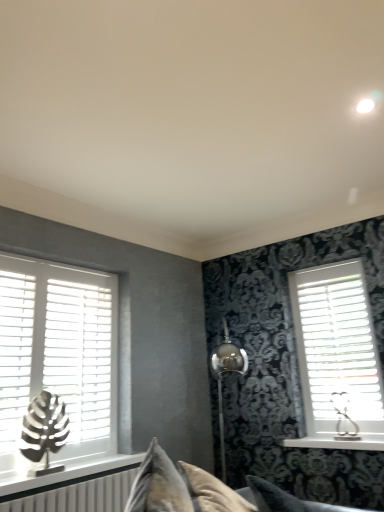
What do you see at coordinates (338, 442) in the screenshot?
I see `white wood window sill at right` at bounding box center [338, 442].

Measure the distance between point (333, 416) and camera.

Point (333, 416) and camera are 2.78 meters apart from each other.

The width and height of the screenshot is (384, 512). Describe the element at coordinates (80, 355) in the screenshot. I see `white matte blinds at left` at that location.

Measure the distance between white matte shutter at left and camera.

The distance of white matte shutter at left from camera is 6.87 feet.

You are a GUI agent. You are given a task and a screenshot of the screen. Output one action in this format:
    pyautogui.click(x=<x>, y=<y>)
    Task: Click on the velvet gray pillow at lower center
    
    Given the screenshot: What is the action you would take?
    pyautogui.click(x=286, y=499)

Who is shorter, white matte blinds at left or white wood blinds at left, which appears as the 1th window when viewed from the left?

Standing shorter between the two is white matte blinds at left.

From a real-world perspective, is white matte blinds at left under white wood blinds at left, which appears as the 2th window when viewed from the right?

Yes.

In terms of size, does white matte blinds at left appear bigger or smaller than white wood blinds at left, which appears as the 1th window when viewed from the left?

Clearly, white matte blinds at left is smaller in size than white wood blinds at left, which appears as the 1th window when viewed from the left.

Considering the relative sizes of metallic leaf sculpture at left, marked as the second table lamp in a back-to-front arrangement, and white plastic blinds at right, which is the 1th window in right-to-left order, in the image provided, is metallic leaf sculpture at left, marked as the second table lamp in a back-to-front arrangement, shorter than white plastic blinds at right, which is the 1th window in right-to-left order,?

Indeed, metallic leaf sculpture at left, marked as the second table lamp in a back-to-front arrangement, has a lesser height compared to white plastic blinds at right, which is the 1th window in right-to-left order.

Measure the distance between metallic leaf sculpture at left, marked as the second table lamp in a back-to-front arrangement, and white plastic blinds at right, which is the 1th window in right-to-left order.

5.64 feet.

Is metallic leaf sculpture at left, the 2th table lamp when ordered from right to left, facing away from white plastic blinds at right, which is the 1th window in right-to-left order?

That's not correct — metallic leaf sculpture at left, the 2th table lamp when ordered from right to left, is not looking away from white plastic blinds at right, which is the 1th window in right-to-left order.

Considering their positions, is metallic leaf sculpture at left, positioned as the first table lamp in left-to-right order, located in front of or behind white plastic blinds at right, arranged as the second window when viewed from the left?

Clearly, metallic leaf sculpture at left, positioned as the first table lamp in left-to-right order, is in front of white plastic blinds at right, arranged as the second window when viewed from the left.

Considering the relative sizes of velvet gray pillow at lower center and white wood blinds at left, which appears as the 1th window when viewed from the left, in the image provided, is velvet gray pillow at lower center bigger than white wood blinds at left, which appears as the 1th window when viewed from the left,?

Yes, velvet gray pillow at lower center is bigger than white wood blinds at left, which appears as the 1th window when viewed from the left.

Considering the relative sizes of velvet gray pillow at lower center and white wood blinds at left, which appears as the 2th window when viewed from the right, in the image provided, is velvet gray pillow at lower center shorter than white wood blinds at left, which appears as the 2th window when viewed from the right,?

Indeed, velvet gray pillow at lower center has a lesser height compared to white wood blinds at left, which appears as the 2th window when viewed from the right.

Is velvet gray pillow at lower center looking in the opposite direction of white wood blinds at left, which appears as the 1th window when viewed from the left?

velvet gray pillow at lower center is not turned away from white wood blinds at left, which appears as the 1th window when viewed from the left.

Between velvet gray pillow at lower center and white wood blinds at left, which appears as the 1th window when viewed from the left, which one has smaller width?

white wood blinds at left, which appears as the 1th window when viewed from the left, is thinner.

Relative to metallic leaf sculpture at left, marked as the second table lamp in a back-to-front arrangement, is white matte shutter at left in front or behind?

Visually, white matte shutter at left is located behind metallic leaf sculpture at left, marked as the second table lamp in a back-to-front arrangement.

Does white matte shutter at left have a lesser width compared to metallic leaf sculpture at left, marked as the second table lamp in a back-to-front arrangement?

Indeed, white matte shutter at left has a lesser width compared to metallic leaf sculpture at left, marked as the second table lamp in a back-to-front arrangement.

Is white matte shutter at left to the right of metallic leaf sculpture at left, marked as the second table lamp in a back-to-front arrangement, from the viewer's perspective?

In fact, white matte shutter at left is to the left of metallic leaf sculpture at left, marked as the second table lamp in a back-to-front arrangement.

Based on the photo, is white wood window sill at right in front of white matte blinds at left?

That is False.

Is white wood window sill at right positioned far away from white matte blinds at left?

That's right, there is a large distance between white wood window sill at right and white matte blinds at left.

In terms of width, does white wood window sill at right look wider or thinner when compared to white matte blinds at left?

Considering their sizes, white wood window sill at right looks broader than white matte blinds at left.

Does point (322, 507) appear closer or farther from the camera than point (35, 454)?

Point (322, 507) is farther from the camera than point (35, 454).

Considering the positions of objects velvet gray pillow at lower center and metallic leaf sculpture at left, positioned as the first table lamp in left-to-right order, in the image provided, who is more to the left, velvet gray pillow at lower center or metallic leaf sculpture at left, positioned as the first table lamp in left-to-right order,?

Positioned to the left is metallic leaf sculpture at left, positioned as the first table lamp in left-to-right order.

From the image's perspective, is velvet gray pillow at lower center above or below metallic leaf sculpture at left, positioned as the first table lamp in left-to-right order?

Clearly, from the image's perspective, velvet gray pillow at lower center is below metallic leaf sculpture at left, positioned as the first table lamp in left-to-right order.

What's the angular difference between metallic leaf sculpture at left, positioned as the first table lamp in left-to-right order, and white matte shutter at left's facing directions?

There is a 0.00116-degree angle between the facing directions of metallic leaf sculpture at left, positioned as the first table lamp in left-to-right order, and white matte shutter at left.

Considering the relative sizes of metallic leaf sculpture at left, positioned as the first table lamp in left-to-right order, and white matte shutter at left in the image provided, is metallic leaf sculpture at left, positioned as the first table lamp in left-to-right order, wider than white matte shutter at left?

Yes, metallic leaf sculpture at left, positioned as the first table lamp in left-to-right order, is wider than white matte shutter at left.

Does metallic leaf sculpture at left, the 1th table lamp in the front-to-back sequence, have a larger size compared to white matte shutter at left?

No.

From a real-world perspective, does metallic leaf sculpture at left, marked as the second table lamp in a back-to-front arrangement, sit lower than white matte shutter at left?

Yes, from a real-world perspective, metallic leaf sculpture at left, marked as the second table lamp in a back-to-front arrangement, is below white matte shutter at left.

This screenshot has height=512, width=384. I want to click on blind that is behind the white wood blinds at left, which appears as the 2th window when viewed from the right, so click(80, 355).

Where is `window that is the 1st one when counting upward from the metallic leaf sculpture at left, the 1th table lamp in the front-to-back sequence (from the image's perspective)`? window that is the 1st one when counting upward from the metallic leaf sculpture at left, the 1th table lamp in the front-to-back sequence (from the image's perspective) is located at coordinates (337, 352).

Estimate the real-world distances between objects in this image. Which object is further from white wood blinds at left, which appears as the 1th window when viewed from the left, metallic silver table lamp at right, which is the 1th table lamp from back to front, or white wood window sill at right?

Based on the image, metallic silver table lamp at right, which is the 1th table lamp from back to front, appears to be further to white wood blinds at left, which appears as the 1th window when viewed from the left.

Considering their positions, is metallic leaf sculpture at left, marked as the second table lamp in a back-to-front arrangement, positioned closer to white matte blinds at left than white matte shutter at left?

white matte shutter at left is closer to white matte blinds at left.

When comparing their distances from white wood blinds at left, which appears as the 1th window when viewed from the left, does metallic silver table lamp at right, the second table lamp in the front-to-back sequence, or metallic leaf sculpture at left, positioned as the first table lamp in left-to-right order, seem further?

The object further to white wood blinds at left, which appears as the 1th window when viewed from the left, is metallic silver table lamp at right, the second table lamp in the front-to-back sequence.

Looking at the image, which one is located further to metallic silver table lamp at right, the second table lamp in the front-to-back sequence, white matte shutter at left or white wood blinds at left, which appears as the 1th window when viewed from the left?

Based on the image, white matte shutter at left appears to be further to metallic silver table lamp at right, the second table lamp in the front-to-back sequence.

From the image, which object appears to be nearer to velvet gray pillow at lower center, white matte shutter at left or white wood blinds at left, which appears as the 2th window when viewed from the right?

The object closer to velvet gray pillow at lower center is white wood blinds at left, which appears as the 2th window when viewed from the right.

Based on the photo, based on their spatial positions, is metallic silver table lamp at right, the second table lamp in the front-to-back sequence, or velvet beige couch at center closer to metallic leaf sculpture at left, the 1th table lamp in the front-to-back sequence?

velvet beige couch at center lies closer to metallic leaf sculpture at left, the 1th table lamp in the front-to-back sequence, than the other object.

Looking at the image, which one is located closer to white wood blinds at left, which appears as the 2th window when viewed from the right, white wood window sill at right or white plastic blinds at right, arranged as the second window when viewed from the left?

Among the two, white plastic blinds at right, arranged as the second window when viewed from the left, is located nearer to white wood blinds at left, which appears as the 2th window when viewed from the right.

Estimate the real-world distances between objects in this image. Which object is further from white wood window sill at right, velvet beige couch at center or metallic leaf sculpture at left, the 2th table lamp when ordered from right to left?

Based on the image, metallic leaf sculpture at left, the 2th table lamp when ordered from right to left, appears to be further to white wood window sill at right.

The width and height of the screenshot is (384, 512). What are the coordinates of `window sill between velvet beige couch at center and white plastic blinds at right, which is the 1th window in right-to-left order, along the z-axis` in the screenshot? It's located at (338, 442).

At what (x,y) coordinates should I click in order to perform the action: click on pillow between metallic leaf sculpture at left, marked as the second table lamp in a back-to-front arrangement, and white wood window sill at right from left to right. Please return your answer as a coordinate pair (x, y). Looking at the image, I should click on (286, 499).

You are a GUI agent. You are given a task and a screenshot of the screen. Output one action in this format:
    pyautogui.click(x=<x>, y=<y>)
    Task: Click on the blind that lies between white matte shutter at left and metallic leaf sculpture at left, marked as the second table lamp in a back-to-front arrangement, from top to bottom
    The height and width of the screenshot is (512, 384).
    Given the screenshot: What is the action you would take?
    pyautogui.click(x=80, y=355)

This screenshot has height=512, width=384. I want to click on window sill between white wood blinds at left, which appears as the 1th window when viewed from the left, and metallic silver table lamp at right, the 2th table lamp from the left, from left to right, so click(x=338, y=442).